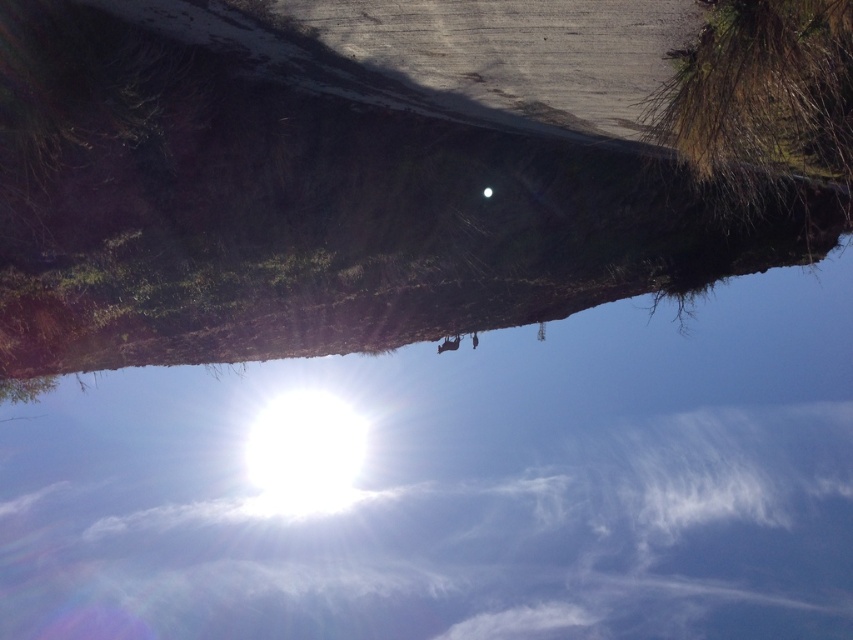
Question: Which point appears farthest from the camera in this image?

Choices:
 (A) (418, 406)
 (B) (660, 124)

Answer: (A)

Question: Can you confirm if transparent glass water at upper center is wider than green mossy tree at upper right?

Choices:
 (A) no
 (B) yes

Answer: (B)

Question: Which point is farther to the camera?

Choices:
 (A) green mossy tree at upper right
 (B) transparent glass water at upper center

Answer: (B)

Question: Can you confirm if transparent glass water at upper center is positioned to the left of green mossy tree at upper right?

Choices:
 (A) no
 (B) yes

Answer: (B)

Question: Can you confirm if transparent glass water at upper center is bigger than green mossy tree at upper right?

Choices:
 (A) no
 (B) yes

Answer: (B)